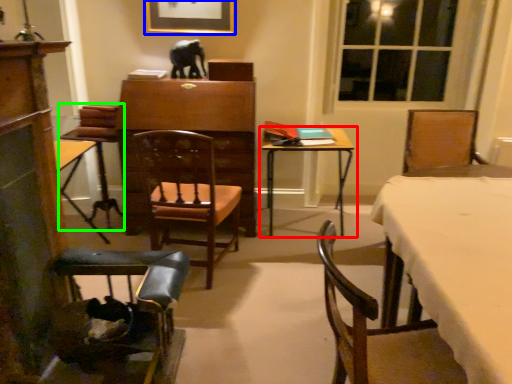
Question: Which is nearer to the table (highlighted by a red box)? picture frame (highlighted by a blue box) or armchair (highlighted by a green box).

Choices:
 (A) picture frame
 (B) armchair

Answer: (A)